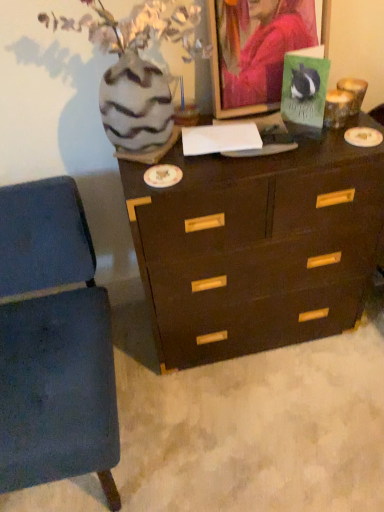
Question: Considering the relative sizes of green matte postcard at upper right and blue fabric chair at lower left in the image provided, is green matte postcard at upper right taller than blue fabric chair at lower left?

Choices:
 (A) yes
 (B) no

Answer: (B)

Question: Considering the relative positions of green matte postcard at upper right and blue fabric chair at lower left in the image provided, is green matte postcard at upper right to the left of blue fabric chair at lower left from the viewer's perspective?

Choices:
 (A) no
 (B) yes

Answer: (A)

Question: Is green matte postcard at upper right surrounding blue fabric chair at lower left?

Choices:
 (A) no
 (B) yes

Answer: (A)

Question: Does green matte postcard at upper right appear on the right side of blue fabric chair at lower left?

Choices:
 (A) no
 (B) yes

Answer: (B)

Question: Are green matte postcard at upper right and blue fabric chair at lower left far apart?

Choices:
 (A) yes
 (B) no

Answer: (B)

Question: Is green matte postcard at upper right positioned in front of blue fabric chair at lower left?

Choices:
 (A) no
 (B) yes

Answer: (A)

Question: From the image's perspective, is blue fabric chair at lower left below green matte postcard at upper right?

Choices:
 (A) yes
 (B) no

Answer: (A)

Question: Is blue fabric chair at lower left far away from green matte postcard at upper right?

Choices:
 (A) yes
 (B) no

Answer: (B)

Question: From a real-world perspective, is blue fabric chair at lower left located higher than green matte postcard at upper right?

Choices:
 (A) yes
 (B) no

Answer: (B)

Question: Is blue fabric chair at lower left thinner than green matte postcard at upper right?

Choices:
 (A) yes
 (B) no

Answer: (B)

Question: Is the surface of blue fabric chair at lower left in direct contact with green matte postcard at upper right?

Choices:
 (A) no
 (B) yes

Answer: (A)

Question: Does blue fabric chair at lower left turn towards green matte postcard at upper right?

Choices:
 (A) yes
 (B) no

Answer: (B)

Question: From a real-world perspective, is speckled ceramic vase at upper left under green matte postcard at upper right?

Choices:
 (A) no
 (B) yes

Answer: (A)